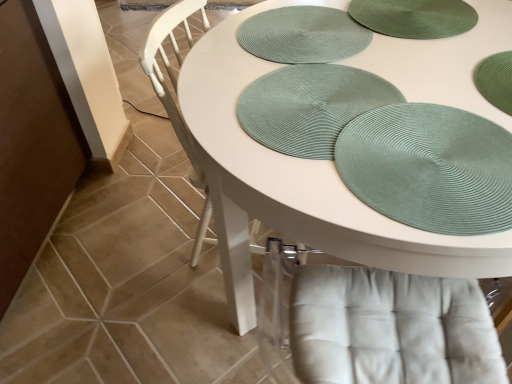
At what (x,y) coordinates should I click in order to perform the action: click on free space between green woven placemat at center, the 2th platter positioned from the back, and green textured placemat at upper right. Please return your answer as a coordinate pair (x, y). Looking at the image, I should click on (393, 115).